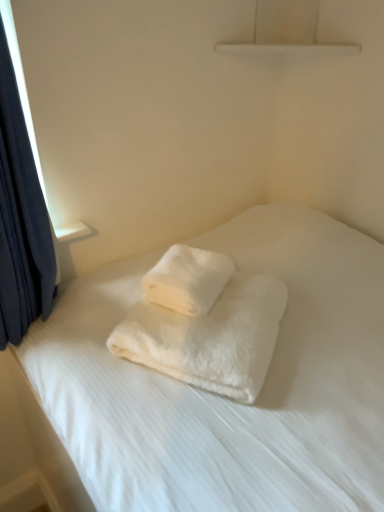
Where is `free space to the left of white fluffy towel at center, which ranks as the 2th towel in bottom-to-top order`? This screenshot has width=384, height=512. free space to the left of white fluffy towel at center, which ranks as the 2th towel in bottom-to-top order is located at coordinates pos(114,290).